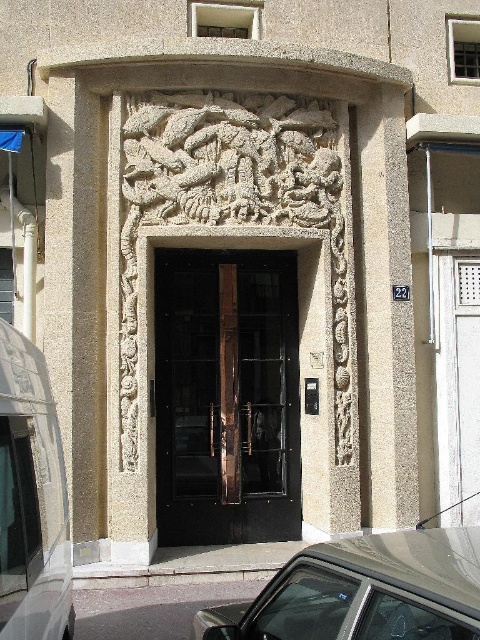
You are standing in front of the building entrance and see the metallic silver car at lower center. If you want to take a photo of the entrance without the car blocking it, where should you move relative to the entrance?

Since the metallic silver car at lower center is located at point (363,592), which is near the lower right corner of the entrance area, you should move to the left side of the entrance to avoid the car blocking the view.

You are a delivery driver who needs to park your white matte van at left near the entrance of the building. The entrance has a polished bronze door at center. Can you park the van in front of the door without blocking it?

The white matte van at left is currently behind the polished bronze door at center, so to park it in front of the door without blocking it, you should move the van forward so it is in front of the door but not obstructing the entrance.

You are a delivery driver who needs to enter the building through the entrance. The entrance has a polished bronze door at center and a metallic silver car at lower center. Which object is located higher up in the image?

The polished bronze door at center is above the metallic silver car at lower center, so the polished bronze door at center is higher up.